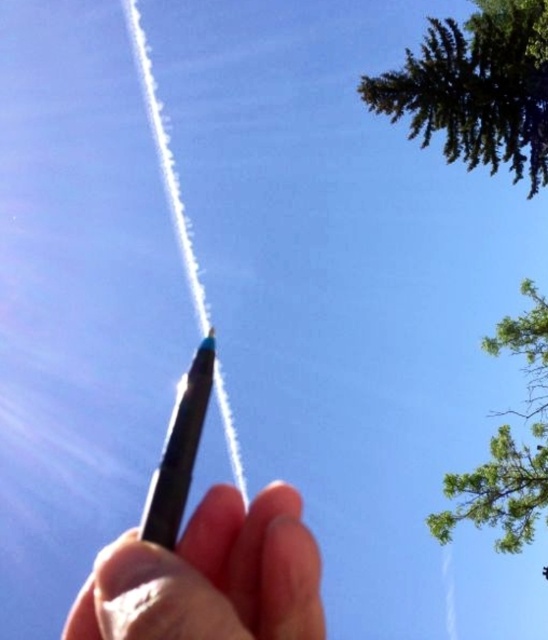
Which is behind, point (471, 28) or point (182, 502)?

Positioned behind is point (471, 28).

Does green leafy tree at upper right have a lesser width compared to matte black pencil at center?

No.

Who is more forward, (430, 134) or (212, 333)?

Positioned in front is point (212, 333).

You are a GUI agent. You are given a task and a screenshot of the screen. Output one action in this format:
    pyautogui.click(x=<x>, y=<y>)
    Task: Click on the green leafy tree at upper right
    This screenshot has width=548, height=640.
    Given the screenshot: What is the action you would take?
    pyautogui.click(x=476, y=88)

Which is above, green leafy tree at upper right or black matte pen at center?

Positioned higher is green leafy tree at upper right.

I want to click on green leafy tree at upper right, so click(476, 88).

Is point (534, 484) behind point (254, 604)?

That is True.

This screenshot has height=640, width=548. I want to click on green leafy tree at upper right, so click(476, 88).

Is black matte pen at center wider than matte black pencil at center?

Incorrect, black matte pen at center's width does not surpass matte black pencil at center's.

Does black matte pen at center have a smaller size compared to matte black pencil at center?

Yes.

Where is `black matte pen at center`? This screenshot has height=640, width=548. black matte pen at center is located at coordinates (209, 577).